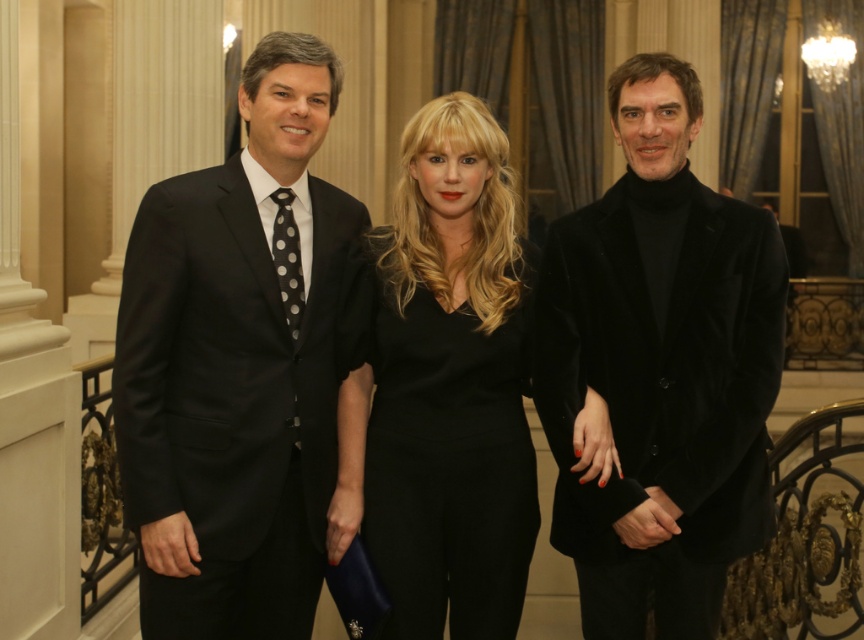
Question: Which point is farther to the camera?

Choices:
 (A) black velvet dress at center
 (B) velvet black jacket at right
 (C) matte black suit at left

Answer: (A)

Question: Considering the relative positions of matte black suit at left and velvet black jacket at right in the image provided, where is matte black suit at left located with respect to velvet black jacket at right?

Choices:
 (A) right
 (B) left

Answer: (B)

Question: Which object appears farthest from the camera in this image?

Choices:
 (A) velvet black jacket at right
 (B) black velvet dress at center
 (C) matte black suit at left

Answer: (B)

Question: Does matte black suit at left come behind velvet black jacket at right?

Choices:
 (A) no
 (B) yes

Answer: (A)

Question: Does matte black suit at left come in front of black velvet dress at center?

Choices:
 (A) no
 (B) yes

Answer: (B)

Question: Which of the following is the farthest from the observer?

Choices:
 (A) matte black suit at left
 (B) black velvet dress at center

Answer: (B)